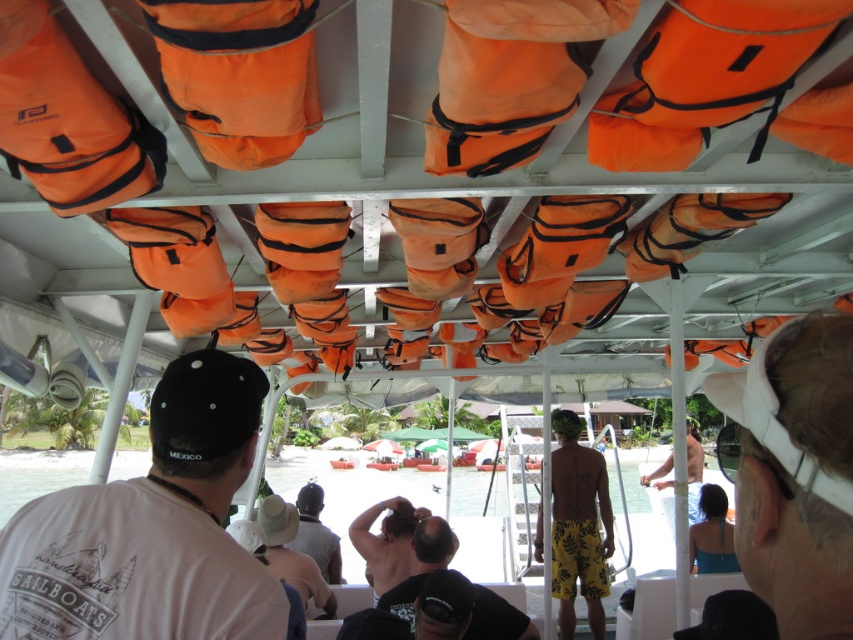
You are a photographer on a boat and want to take a photo of the beige fabric hat at center and the yellow textured shorts at center. Which object should you focus on first if you want to capture both in the same frame without moving the camera?

The yellow textured shorts at center is behind the beige fabric hat at center, so you should focus on the beige fabric hat at center first to ensure both are in focus since it is closer to the camera.

You are a tour guide on a boat and need to hand out items to two tourists. The beige fabric hat at center and the yellow textured shorts at center are both on the deck. If you are standing at the helm, which item is closer to you?

The beige fabric hat at center and yellow textured shorts at center are 10.81 feet apart from each other, so without knowing their exact positions relative to the helm, it is impossible to determine which is closer.

You are a photographer standing on the tropical beach. You want to take a photo of the white matte shirt at center and the beige fabric hat at center so that both are in the frame. If your camera has a maximum focus range of 9 feet, will both items be in focus?

The white matte shirt at center and beige fabric hat at center are 9.38 feet apart from each other. Since the distance between them exceeds the camera focus range of 9 feet, they might not both be in focus simultaneously.